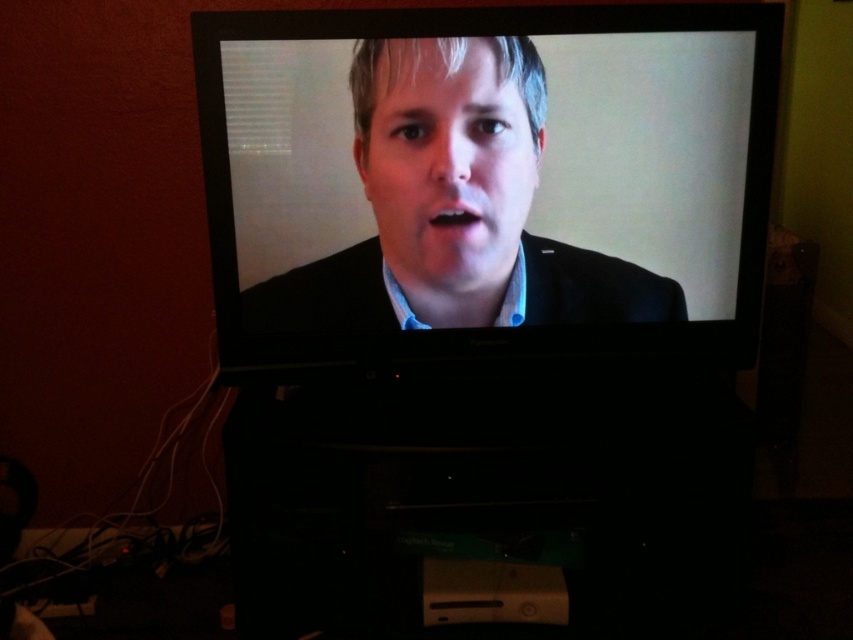
Question: Can you confirm if matte black suit at center is wider than matte black face at center?

Choices:
 (A) yes
 (B) no

Answer: (A)

Question: Which point is closer to the camera?

Choices:
 (A) (543, 266)
 (B) (409, 237)

Answer: (B)

Question: Is matte black face at center wider than black matte business suit at center?

Choices:
 (A) yes
 (B) no

Answer: (B)

Question: Does matte black suit at center have a smaller size compared to black matte business suit at center?

Choices:
 (A) yes
 (B) no

Answer: (B)

Question: Among these points, which one is nearest to the camera?

Choices:
 (A) (605, 305)
 (B) (430, 276)
 (C) (618, 260)

Answer: (B)

Question: Which of the following is the closest to the observer?

Choices:
 (A) matte black suit at center
 (B) black matte business suit at center
 (C) matte black face at center

Answer: (A)